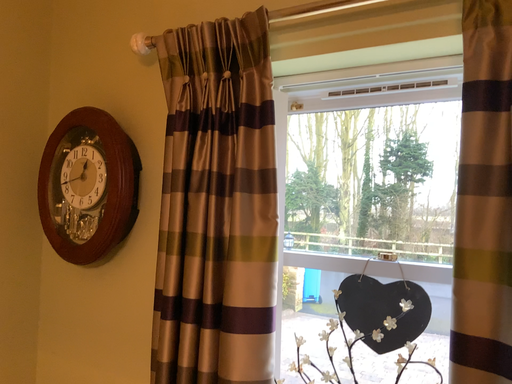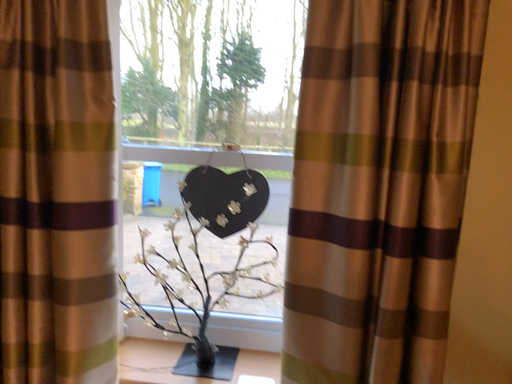
Question: Which way did the camera rotate in the video?

Choices:
 (A) rotated upward
 (B) rotated downward

Answer: (B)